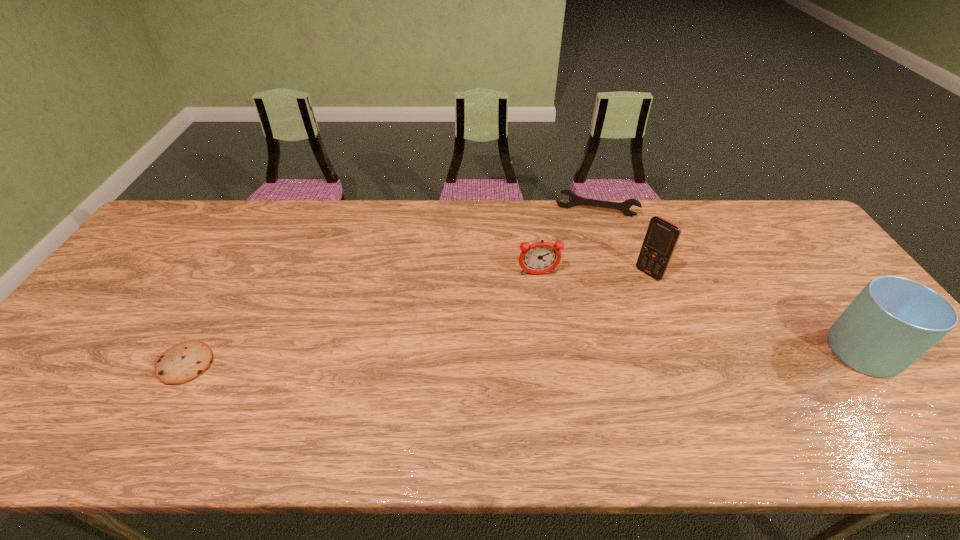
Find the location of a particular element. The image size is (960, 540). vacant space that's between the alarm clock and the rightmost object is located at coordinates (705, 313).

Identify the location of free space between the fourth object from right to left and the leftmost object. (362, 319).

Locate an element on the screen. vacant area that lies between the shortest object and the second object from left to right is located at coordinates [362, 319].

Identify the location of free spot between the cellular telephone and the mug. The width and height of the screenshot is (960, 540). (759, 313).

Where is `vacant region between the rightmost object and the shortest object`? The image size is (960, 540). vacant region between the rightmost object and the shortest object is located at coordinates (529, 358).

Image resolution: width=960 pixels, height=540 pixels. In order to click on empty space that is in between the alarm clock and the shortest object in this screenshot , I will do `click(362, 319)`.

Where is `empty space between the cellular telephone and the fourth tallest object`? empty space between the cellular telephone and the fourth tallest object is located at coordinates (622, 242).

Image resolution: width=960 pixels, height=540 pixels. I want to click on empty space between the third tallest object and the cookie, so click(362, 319).

You are a GUI agent. You are given a task and a screenshot of the screen. Output one action in this format:
    pyautogui.click(x=<x>, y=<y>)
    Task: Click on the object that is the fourth closest to the cellular telephone
    
    Given the screenshot: What is the action you would take?
    pyautogui.click(x=184, y=362)

Point out which object is positioned as the second nearest to the alarm clock. Please provide its 2D coordinates. Your answer should be formatted as a tuple, i.e. [(x, y)], where the tuple contains the x and y coordinates of a point satisfying the conditions above.

[(575, 200)]